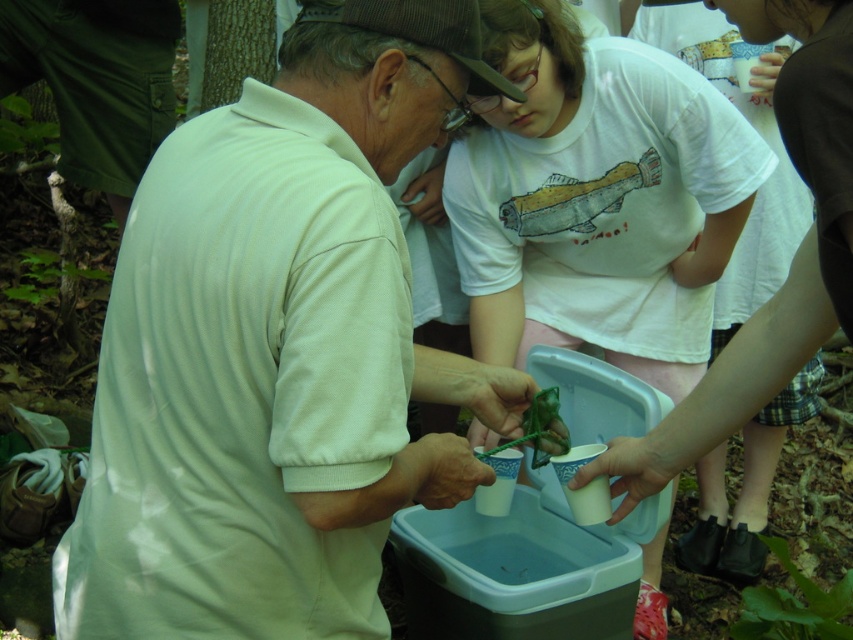
Question: Which is nearer to the green leafy plant at lower right?

Choices:
 (A) white cotton shirt at center
 (B) white matte shirt at center

Answer: (A)

Question: Does white matte shirt at center have a greater width compared to green leafy plant at lower right?

Choices:
 (A) no
 (B) yes

Answer: (B)

Question: Among these objects, which one is farthest from the camera?

Choices:
 (A) white matte shirt at center
 (B) white cotton shirt at center

Answer: (B)

Question: Is white matte shirt at center above white cotton shirt at center?

Choices:
 (A) no
 (B) yes

Answer: (A)

Question: Which of the following is the closest to the observer?

Choices:
 (A) white cotton shirt at center
 (B) green leafy plant at lower right
 (C) white matte shirt at center

Answer: (C)

Question: Is white matte shirt at center further to camera compared to white cotton shirt at center?

Choices:
 (A) yes
 (B) no

Answer: (B)